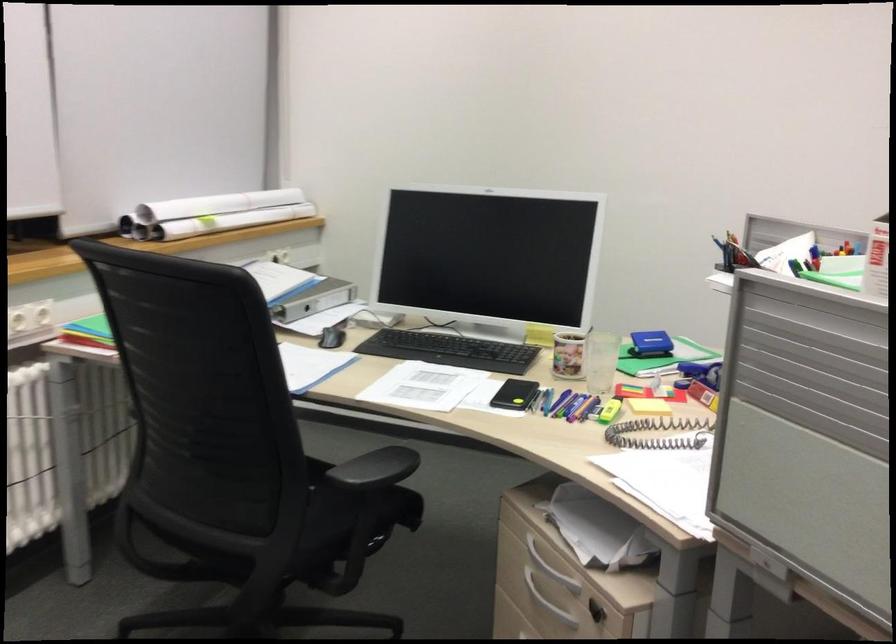
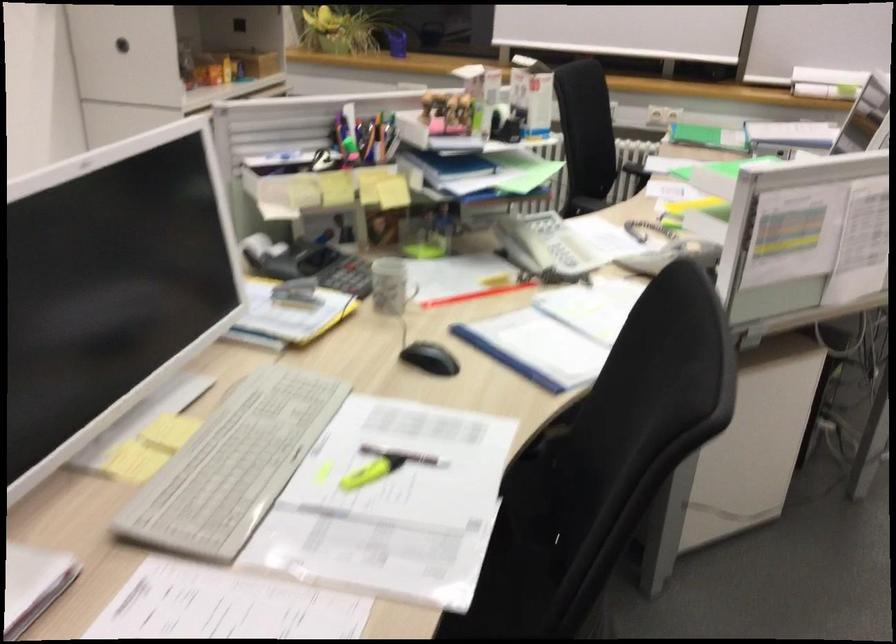
Question: I am providing you with two images of the same scene from different viewpoints. Please identify which objects are invisible in image2.

Choices:
 (A) black chair sitting surface
 (B) black chair armrest
 (C) blue wheeled suitcase
 (D) cabinet lock

Answer: (D)